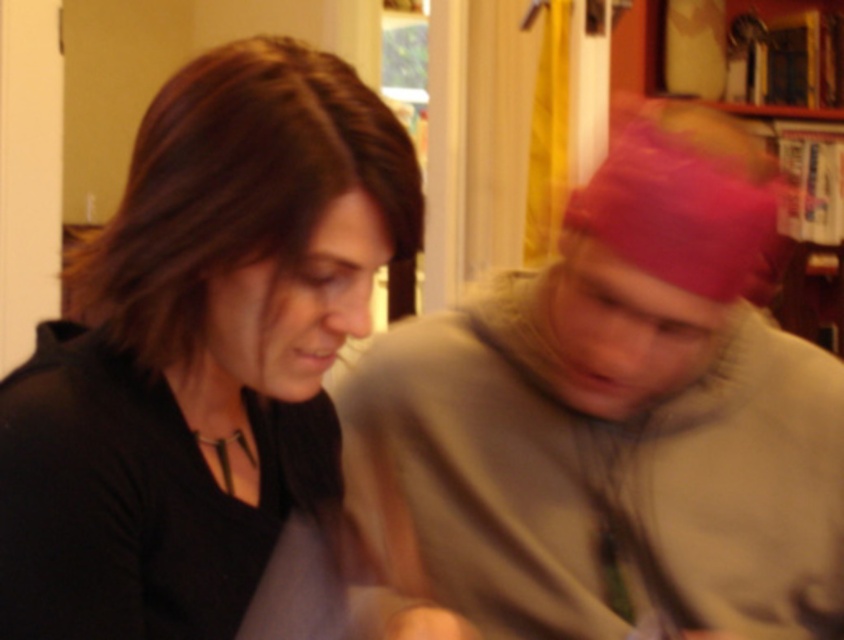
You are trying to locate the gray fleece sweater at center in the image. According to the coordinates provided, where exactly is it positioned?

The gray fleece sweater at center is located at point coordinates of 0.666 on the x axis and 0.724 on the y axis.

You are a delivery person who needs to place a package that is 2 meters long between the gray fleece sweater at center and the wooden bookshelf at upper right. Is there enough space to fit the package between them?

The distance between the gray fleece sweater at center and the wooden bookshelf at upper right is 1.97 meters. Since the package is 2 meters long, it is slightly longer than the available space. Therefore, the package cannot fit between them.